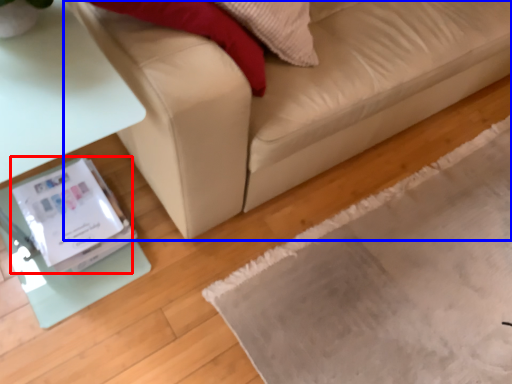
Question: Which point is closer to the camera, Wii (highlighted by a red box) or studio couch (highlighted by a blue box)?

Choices:
 (A) Wii
 (B) studio couch

Answer: (B)